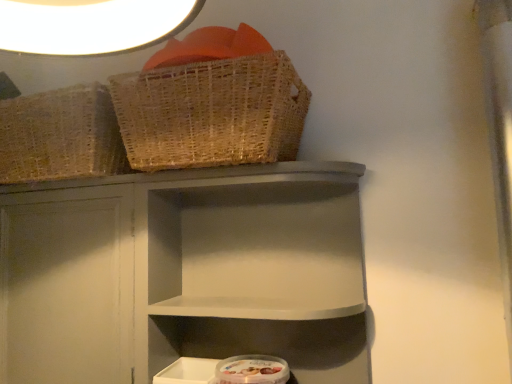
Question: From a real-world perspective, is woven natural basket at upper center located higher than matte gray shelf at center?

Choices:
 (A) yes
 (B) no

Answer: (A)

Question: From the image's perspective, is woven natural basket at upper center located beneath matte gray shelf at center?

Choices:
 (A) no
 (B) yes

Answer: (A)

Question: Is woven natural basket at upper center beside matte gray shelf at center?

Choices:
 (A) yes
 (B) no

Answer: (B)

Question: Is matte gray shelf at center surrounded by woven natural basket at upper center?

Choices:
 (A) no
 (B) yes

Answer: (A)

Question: From a real-world perspective, is woven natural basket at upper center located beneath matte gray shelf at center?

Choices:
 (A) yes
 (B) no

Answer: (B)

Question: From the image's perspective, is woven natural basket at upper center on top of matte gray shelf at center?

Choices:
 (A) no
 (B) yes

Answer: (B)

Question: Are matte gray shelf at center and woven natural basket at upper center located far from each other?

Choices:
 (A) no
 (B) yes

Answer: (A)

Question: Is matte gray shelf at center bigger than woven natural basket at upper center?

Choices:
 (A) no
 (B) yes

Answer: (B)

Question: Is matte gray shelf at center not within woven natural basket at upper center?

Choices:
 (A) no
 (B) yes

Answer: (B)

Question: Does matte gray shelf at center have a lesser width compared to woven natural basket at upper center?

Choices:
 (A) yes
 (B) no

Answer: (A)

Question: From the image's perspective, is matte gray shelf at center over woven natural basket at upper center?

Choices:
 (A) yes
 (B) no

Answer: (B)

Question: Is matte gray shelf at center at the left side of woven natural basket at upper center?

Choices:
 (A) no
 (B) yes

Answer: (A)

Question: Considering the relative positions of matte gray shelf at center and woven natural basket at upper center in the image provided, is matte gray shelf at center to the left or to the right of woven natural basket at upper center?

Choices:
 (A) right
 (B) left

Answer: (A)